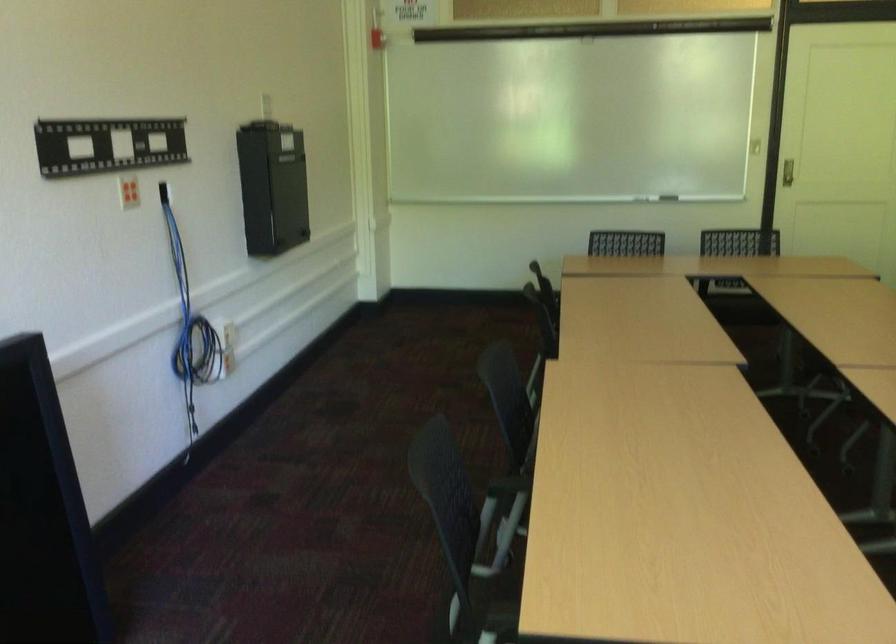
Find where to pull the red fire alarm. Please return your answer as a coordinate pair (x, y).

(375, 38)